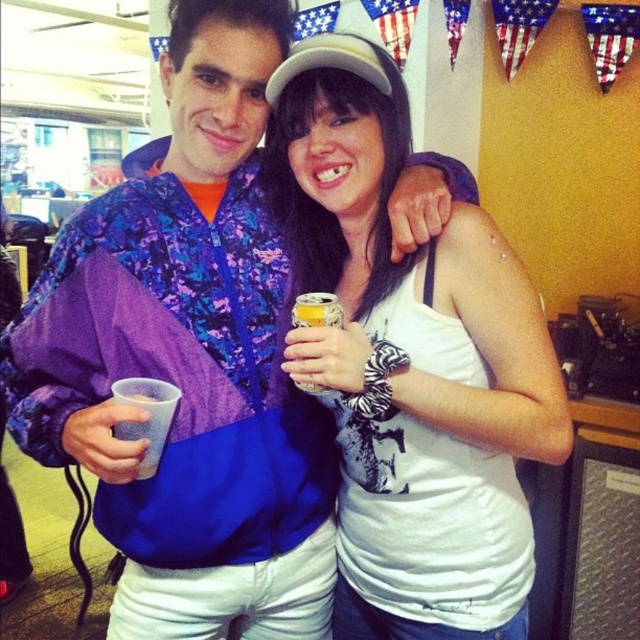
Who is more forward, (138,426) or (292,314)?

Point (138,426) is more forward.

Can you confirm if white plastic cup at left is positioned above yellow metallic can at center?

No.

Between point (144, 401) and point (301, 384), which one is positioned behind?

The point (301, 384) is behind.

Locate an element on the screen. This screenshot has width=640, height=640. white plastic cup at left is located at coordinates (147, 417).

Who is more forward, (177, 440) or (460, 609)?

Point (177, 440) is more forward.

Can you confirm if brushed metal cup at upper left is smaller than white matte tank top at center?

Actually, brushed metal cup at upper left might be larger than white matte tank top at center.

Between point (186, 616) and point (429, 497), which one is positioned in front?

Point (429, 497) is in front.

Locate an element on the screen. The image size is (640, 640). brushed metal cup at upper left is located at coordinates (193, 348).

Is brushed metal cup at upper left in front of white plastic cup at left?

No.

This screenshot has width=640, height=640. Describe the element at coordinates (193, 348) in the screenshot. I see `brushed metal cup at upper left` at that location.

The image size is (640, 640). Identify the location of brushed metal cup at upper left. (193, 348).